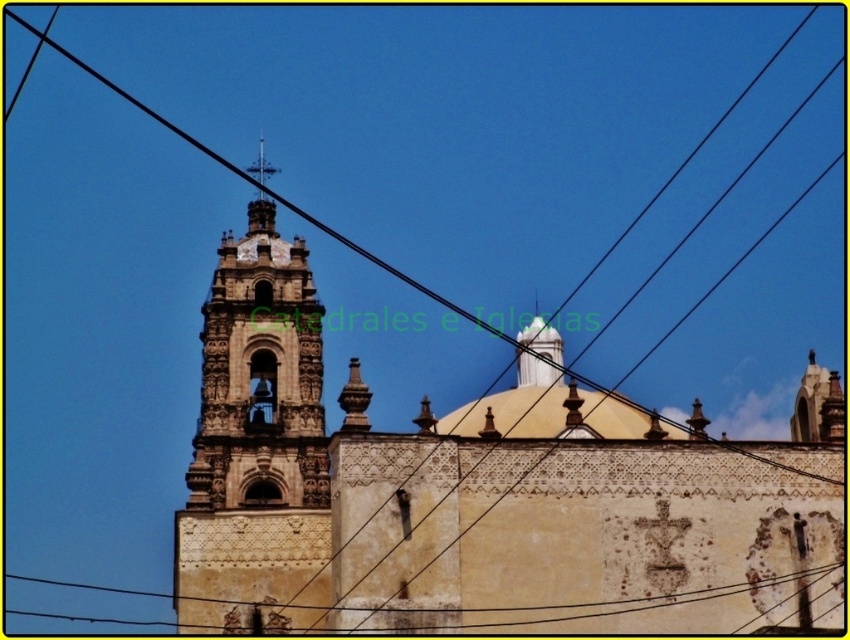
You are standing in front of the historic church and notice two elements in the scene. One is the black wire at upper center and the other is the yellow stucco church at center. Which of these two elements is taller?

The black wire at upper center is taller than the yellow stucco church at center according to the description provided.

You are a tourist standing in front of the historic church. You notice two structures in the center area. Which one is taller? The yellow stucco church at center or the carved stone tower at center?

The carved stone tower at center is taller than the yellow stucco church at center.

You are an architect analyzing the church structure. You notice the black wire at upper center and the yellow stucco church at center. Which of these two elements has a greater visual prominence in the image?

The black wire at upper center has a larger size compared to the yellow stucco church at center, making it more visually prominent.